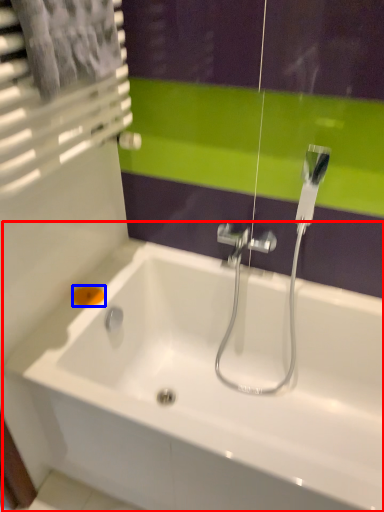
Question: Among these objects, which one is farthest to the camera, bathtub (highlighted by a red box) or soap (highlighted by a blue box)?

Choices:
 (A) bathtub
 (B) soap

Answer: (B)